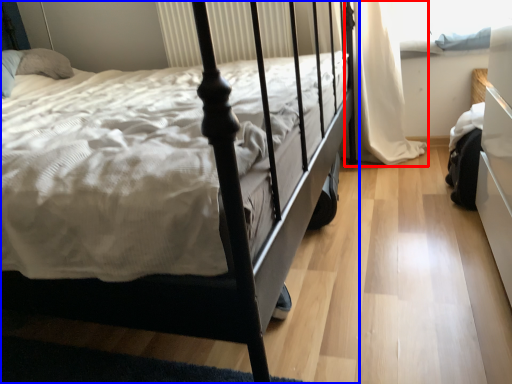
Question: Among these objects, which one is nearest to the camera, curtain (highlighted by a red box) or bed (highlighted by a blue box)?

Choices:
 (A) curtain
 (B) bed

Answer: (B)